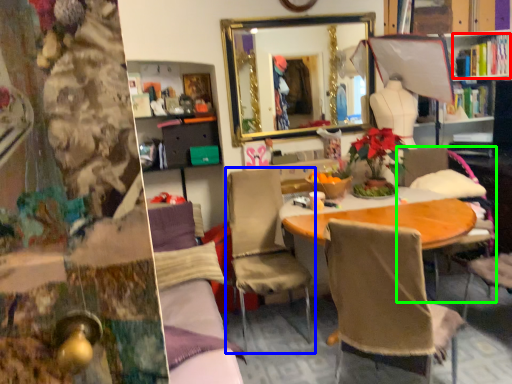
Question: Considering the real-world distances, which object is farthest from book (highlighted by a red box)? chair (highlighted by a blue box) or chair (highlighted by a green box)?

Choices:
 (A) chair
 (B) chair

Answer: (A)